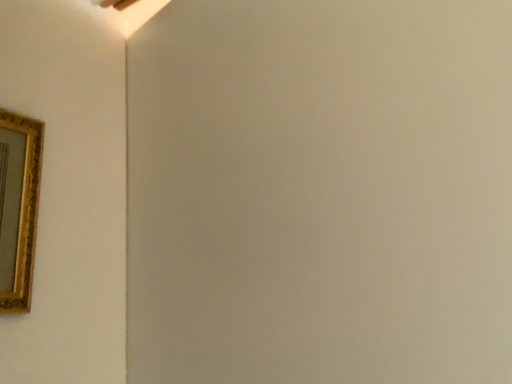
This screenshot has height=384, width=512. What do you see at coordinates (18, 207) in the screenshot? I see `gold ornate frame at upper left` at bounding box center [18, 207].

What are the coordinates of `gold ornate frame at upper left` in the screenshot? It's located at (18, 207).

The width and height of the screenshot is (512, 384). Find the location of `gold ornate frame at upper left`. gold ornate frame at upper left is located at coordinates (18, 207).